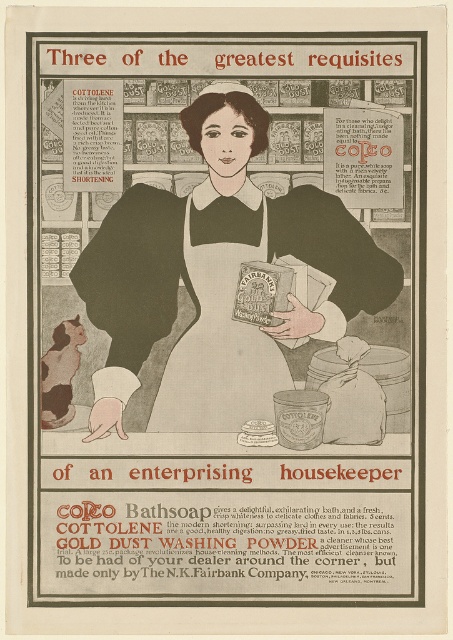
Question: Which of the following is the closest to the observer?

Choices:
 (A) matte cardboard box at center
 (B) matte black apron at center

Answer: (B)

Question: Does matte black apron at center appear on the right side of matte cardboard box at center?

Choices:
 (A) no
 (B) yes

Answer: (A)

Question: Can you confirm if white cotton apron at center is positioned to the right of matte cardboard box at center?

Choices:
 (A) no
 (B) yes

Answer: (A)

Question: Which object is closer to the camera taking this photo?

Choices:
 (A) matte black apron at center
 (B) white cotton apron at center
 (C) matte cardboard box at center

Answer: (A)

Question: Among these points, which one is farthest from the camera?

Choices:
 (A) (121, 428)
 (B) (250, 422)
 (C) (229, 356)

Answer: (B)

Question: Does matte black apron at center appear over white cotton apron at center?

Choices:
 (A) yes
 (B) no

Answer: (A)